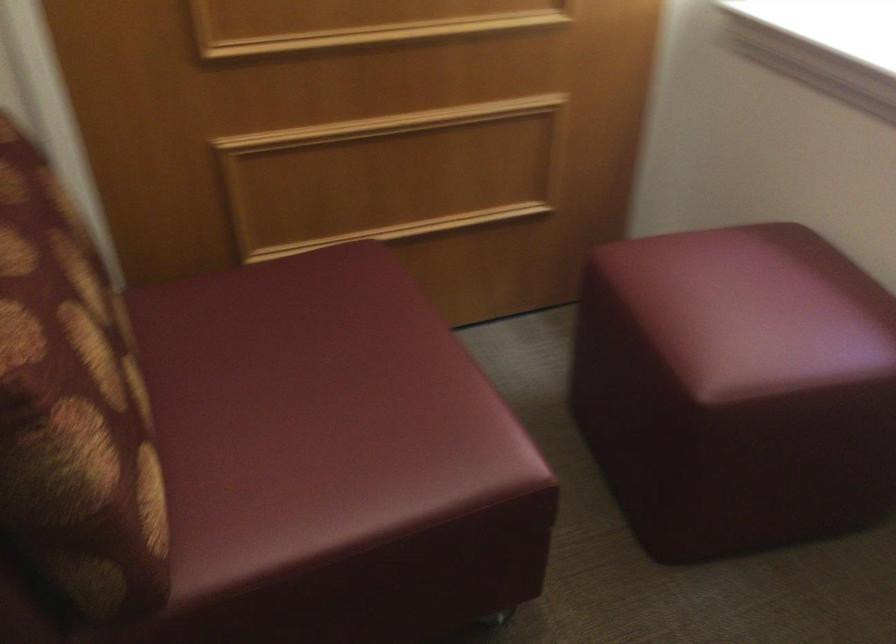
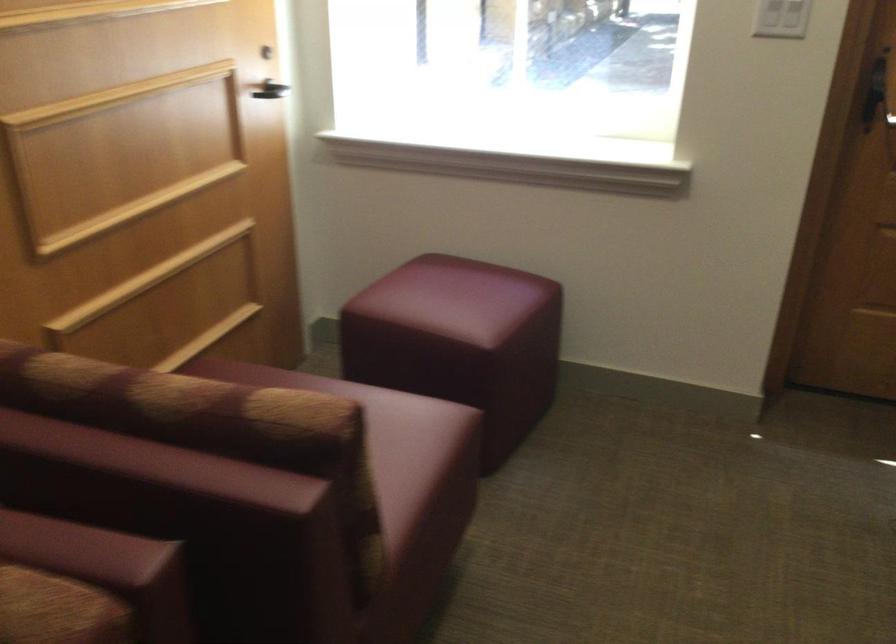
Find the pixel in the second image that matches point (407, 456) in the first image.

(392, 444)